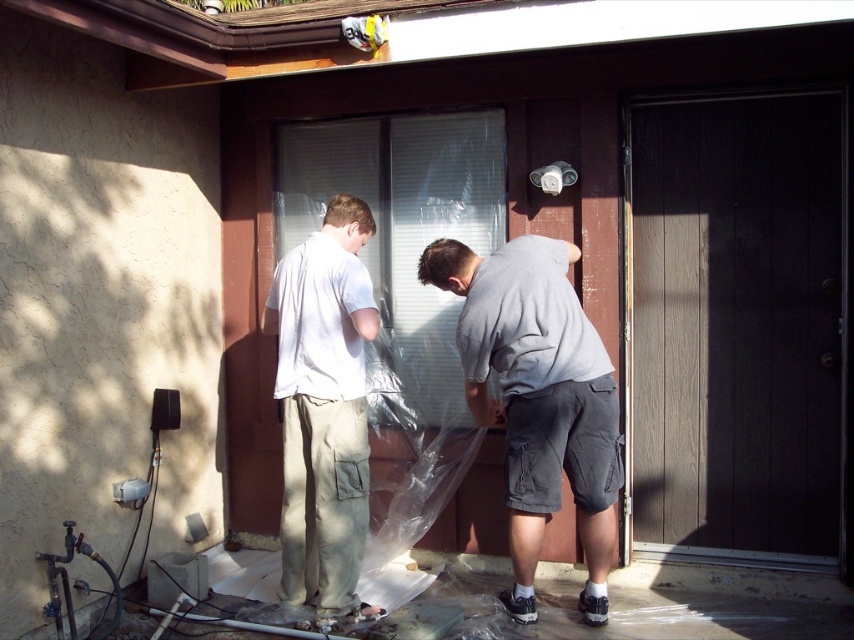
You are a delivery person trying to deliver a package to the house. You see the dark wood screen door at right and the light beige cargo pants at center. Which object is closer to you?

The dark wood screen door at right is closer to you because the light beige cargo pants at center is behind it.

You are a delivery person with a 3.5 meter ladder. You need to place the ladder against the dark wood screen door at right to deliver a package. Can you safely place the ladder within the available space?

The distance between the dark wood screen door at right and the camera is 3.66 meters. Since the ladder is 3.5 meters long, it can be safely placed within the available space as it is shorter than the distance required.